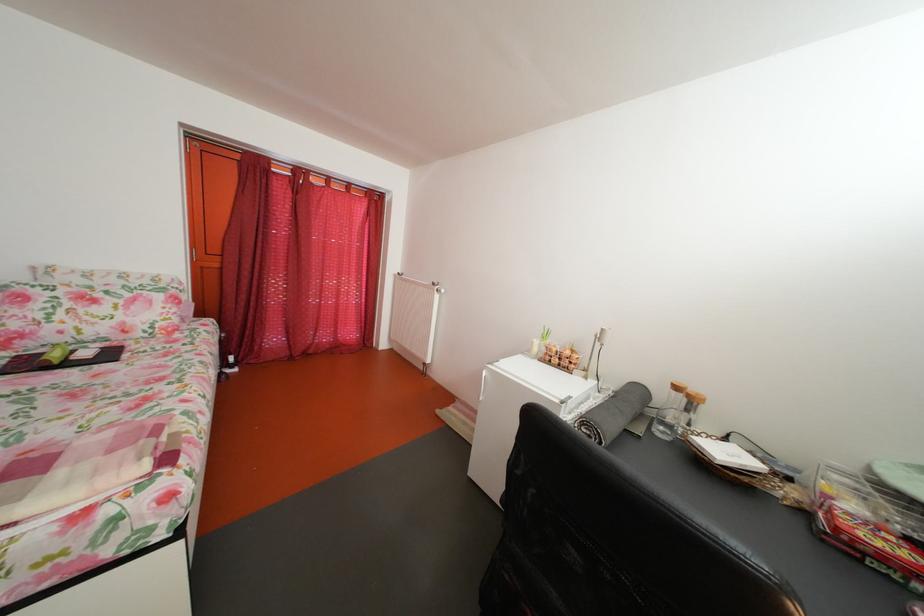
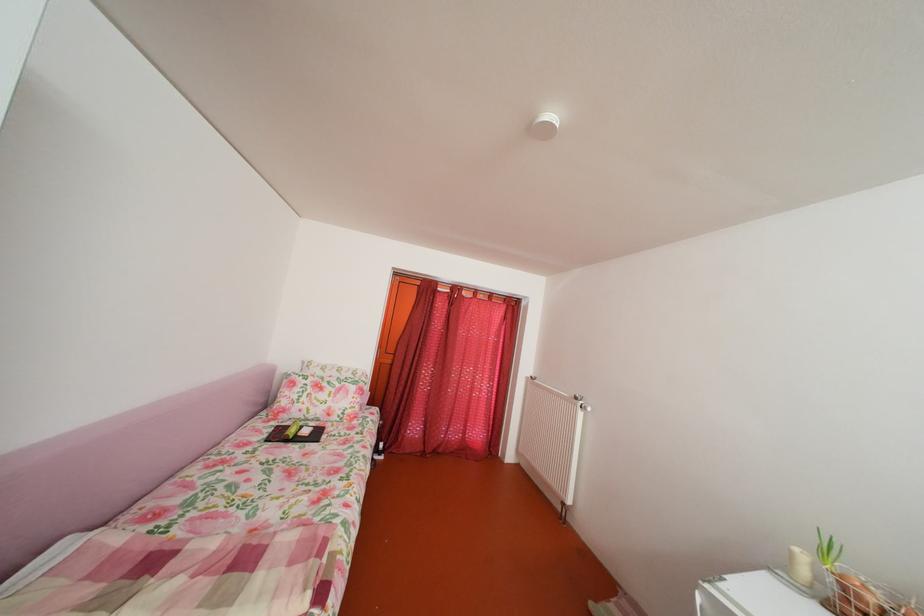
Where in the second image is the point corresponding to point 66,363 from the first image?

(304, 438)